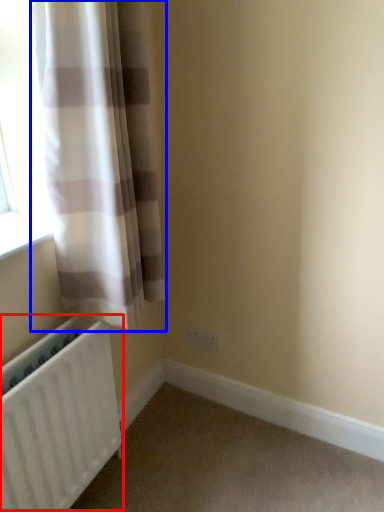
Question: Which object is further to the camera taking this photo, radiator (highlighted by a red box) or curtain (highlighted by a blue box)?

Choices:
 (A) radiator
 (B) curtain

Answer: (A)